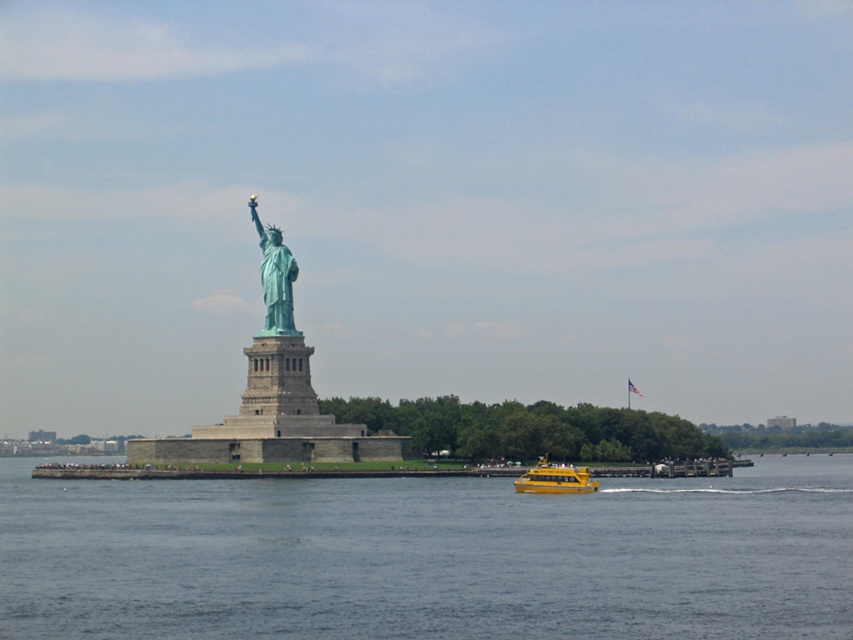
Question: Which is farther from the green patina statue at center?

Choices:
 (A) yellow plastic boat at lower center
 (B) blue water at center

Answer: (B)

Question: Does blue water at center have a lesser width compared to yellow plastic boat at lower center?

Choices:
 (A) yes
 (B) no

Answer: (B)

Question: Is blue water at center to the right of yellow plastic boat at lower center from the viewer's perspective?

Choices:
 (A) yes
 (B) no

Answer: (B)

Question: Which point appears closest to the camera in this image?

Choices:
 (A) (581, 484)
 (B) (329, 481)

Answer: (A)

Question: Which point appears closest to the camera in this image?

Choices:
 (A) [253, 214]
 (B) [538, 477]

Answer: (B)

Question: Does blue water at center have a lesser width compared to green patina statue at center?

Choices:
 (A) yes
 (B) no

Answer: (B)